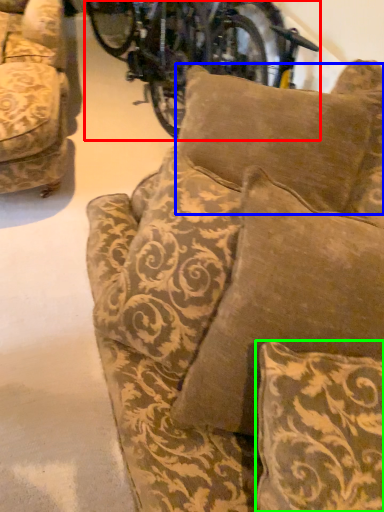
Question: Considering the real-world distances, which object is closest to bicycle (highlighted by a red box)? pillow (highlighted by a blue box) or pillow (highlighted by a green box).

Choices:
 (A) pillow
 (B) pillow

Answer: (A)